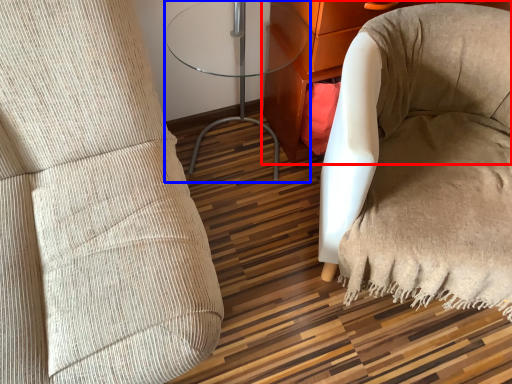
Question: Which object appears farthest to the camera in this image, furniture (highlighted by a red box) or table (highlighted by a blue box)?

Choices:
 (A) furniture
 (B) table

Answer: (A)